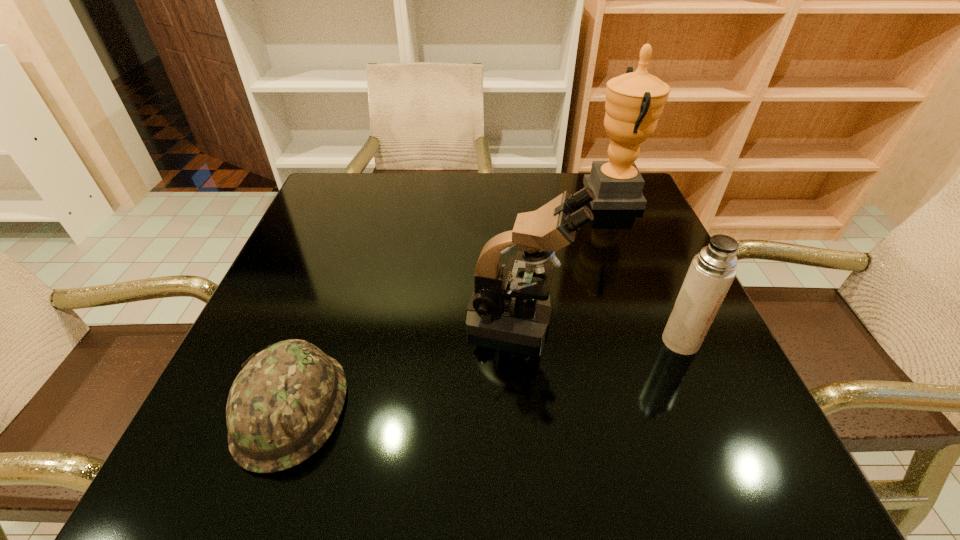
This screenshot has width=960, height=540. What are the coordinates of `vacant space at the far edge` in the screenshot? It's located at (389, 173).

Find the location of a particular element. free space at the near edge is located at coordinates [390, 471].

Image resolution: width=960 pixels, height=540 pixels. I want to click on vacant space at the left edge, so pos(297,294).

The height and width of the screenshot is (540, 960). What are the coordinates of `vacant region at the right edge` in the screenshot? It's located at (686, 384).

Identify the location of vacant space at the far left corner of the desktop. The width and height of the screenshot is (960, 540). (363, 210).

The height and width of the screenshot is (540, 960). Identify the location of empty space between the tallest object and the third object from right to left. (566, 256).

The width and height of the screenshot is (960, 540). In order to click on vacant space that's between the thermos bottle and the microscope in this screenshot , I will do `click(600, 330)`.

This screenshot has width=960, height=540. I want to click on free space between the thermos bottle and the leftmost object, so click(x=486, y=375).

I want to click on empty location between the award and the third tallest object, so click(647, 268).

In order to click on vacant area that lies between the second shortest object and the leftmost object in this screenshot , I will do `click(486, 375)`.